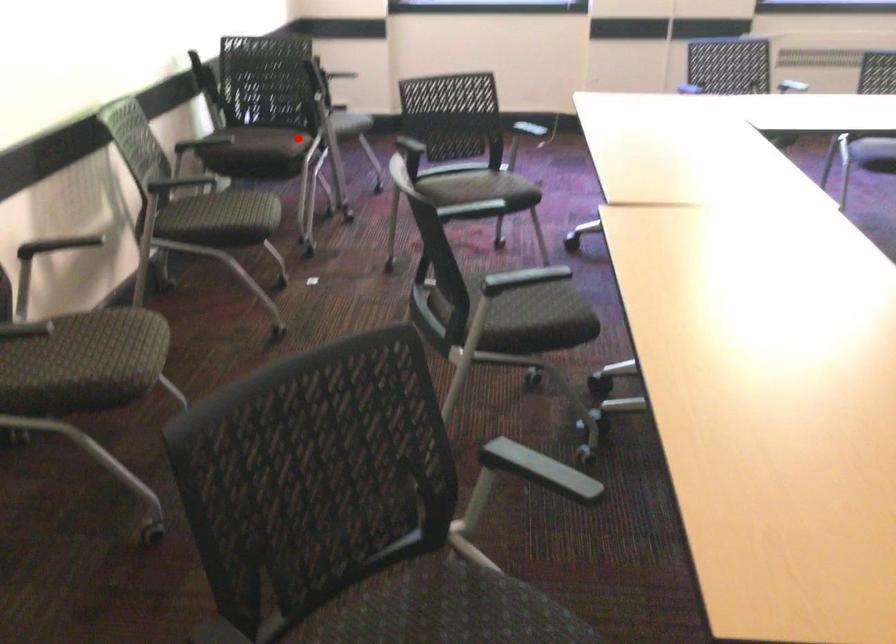
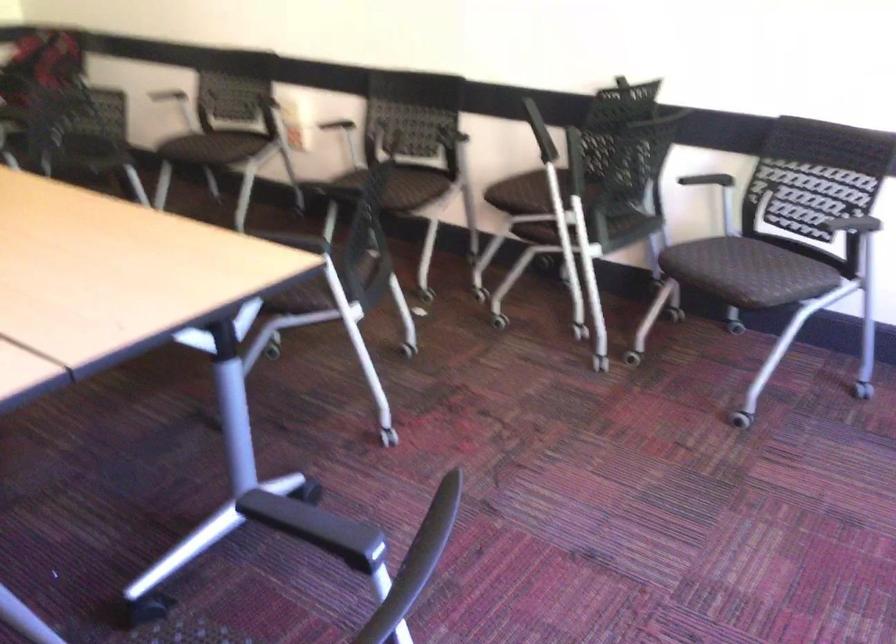
Question: I am providing you with two images of the same scene from different viewpoints. A red point is marked on the first image. Can you still see the location of the red point in image 2?

Choices:
 (A) Yes
 (B) No

Answer: (A)